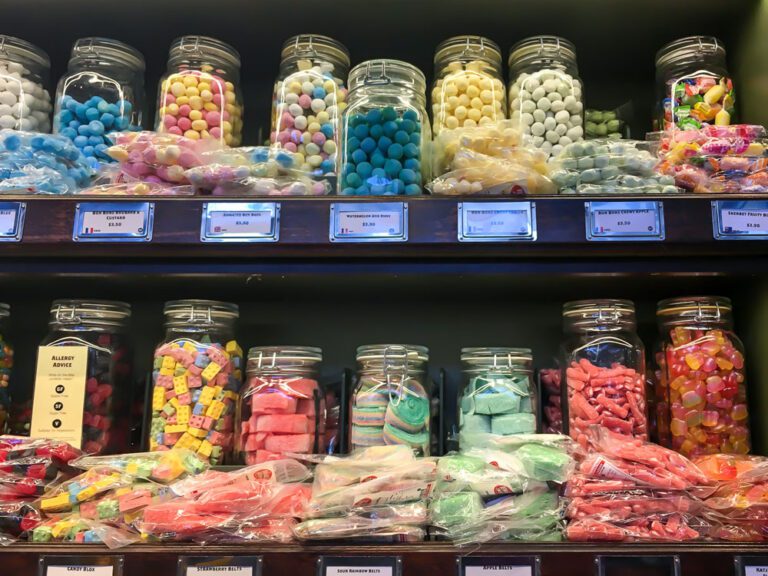
The image size is (768, 576). Identify the location of wall. (346, 312).